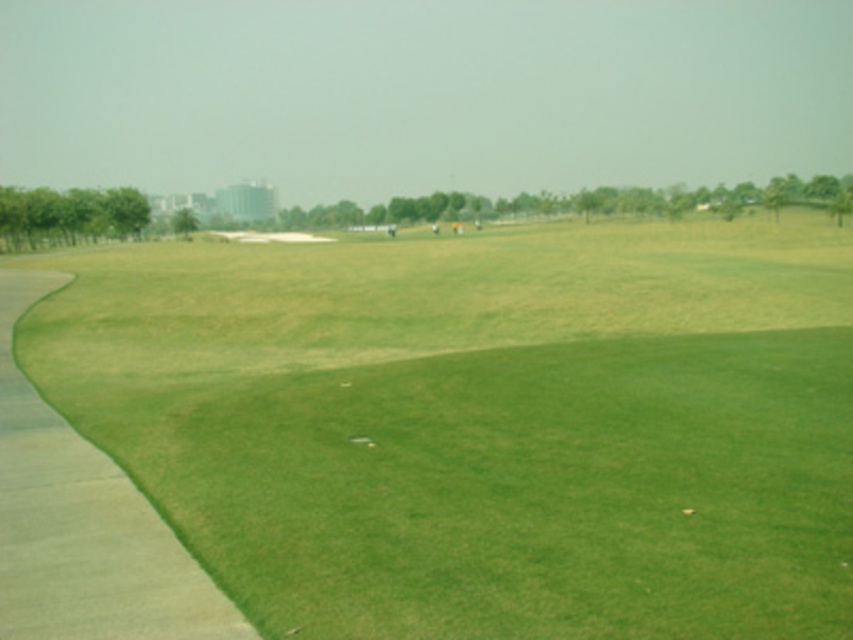
Question: Can you confirm if green grass at center is positioned to the left of green grass at left?

Choices:
 (A) yes
 (B) no

Answer: (A)

Question: Which object is closer to the camera taking this photo?

Choices:
 (A) green grass at center
 (B) green grass at left

Answer: (B)

Question: Considering the relative positions of green grass at center and green grass at left in the image provided, where is green grass at center located with respect to green grass at left?

Choices:
 (A) below
 (B) above

Answer: (B)

Question: Where is green grass at center located in relation to green grass at left in the image?

Choices:
 (A) above
 (B) below

Answer: (A)